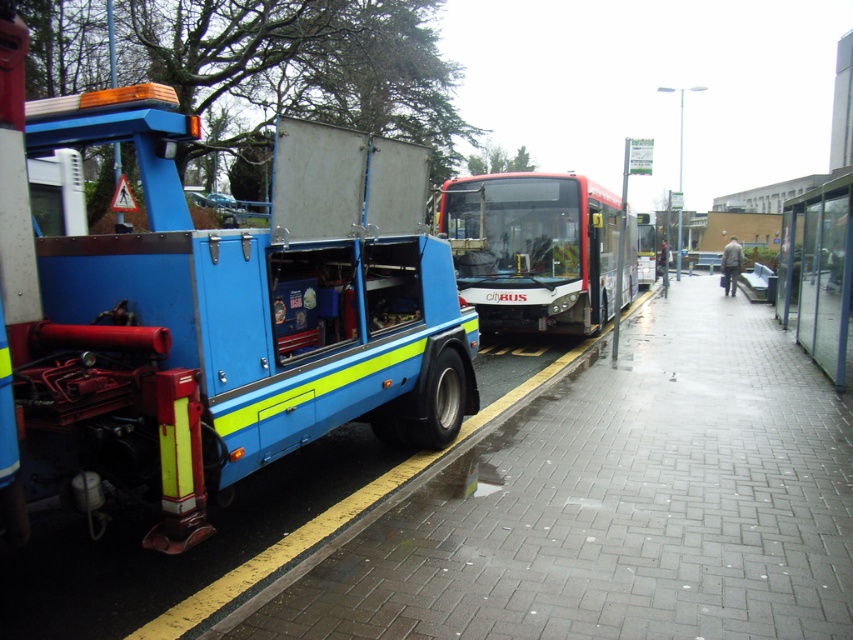
Question: Which is nearer to the white glossy bus at center?

Choices:
 (A) blue metallic tow truck at left
 (B) transparent glass bus stop at right

Answer: (B)

Question: Can you confirm if blue metallic tow truck at left is bigger than white glossy bus at center?

Choices:
 (A) yes
 (B) no

Answer: (B)

Question: Which of these objects is positioned farthest from the white glossy bus at center?

Choices:
 (A) blue metallic tow truck at left
 (B) transparent glass bus stop at right

Answer: (A)

Question: In this image, where is blue metallic tow truck at left located relative to brick paved sidewalk at lower left?

Choices:
 (A) below
 (B) above

Answer: (B)

Question: Among these points, which one is nearest to the camera?

Choices:
 (A) (386, 236)
 (B) (804, 320)
 (C) (335, 598)

Answer: (C)

Question: From the image, what is the correct spatial relationship of white glossy bus at center in relation to transparent glass bus stop at right?

Choices:
 (A) right
 (B) left

Answer: (B)